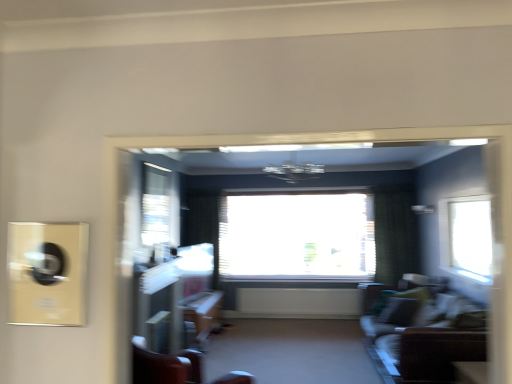
Question: Is transparent glass window at upper center, which appears as the 2th window when viewed from the back, behind velvet green sofa at lower right?

Choices:
 (A) yes
 (B) no

Answer: (A)

Question: Does transparent glass window at upper center, which appears as the 2th window when viewed from the back, have a smaller size compared to velvet green sofa at lower right?

Choices:
 (A) no
 (B) yes

Answer: (B)

Question: Is transparent glass window at upper center, the third window when ordered from right to left, positioned beyond the bounds of velvet green sofa at lower right?

Choices:
 (A) yes
 (B) no

Answer: (A)

Question: From the image's perspective, is transparent glass window at upper center, which appears as the 2th window when viewed from the back, on velvet green sofa at lower right?

Choices:
 (A) yes
 (B) no

Answer: (A)

Question: From a real-world perspective, is transparent glass window at upper center, the third window when ordered from right to left, below velvet green sofa at lower right?

Choices:
 (A) no
 (B) yes

Answer: (A)

Question: Considering the positions of matte brown table at lower right, the second table in the back-to-front sequence, and transparent glass window at center, arranged as the 2th window when viewed from the left, in the image, is matte brown table at lower right, the second table in the back-to-front sequence, wider or thinner than transparent glass window at center, arranged as the 2th window when viewed from the left,?

Choices:
 (A) wide
 (B) thin

Answer: (B)

Question: Considering their positions, is matte brown table at lower right, the second table in the back-to-front sequence, located in front of or behind transparent glass window at center, acting as the 3th window starting from the front?

Choices:
 (A) front
 (B) behind

Answer: (A)

Question: From a real-world perspective, is matte brown table at lower right, which ranks as the 1th table in right-to-left order, physically located above or below transparent glass window at center, acting as the 3th window starting from the front?

Choices:
 (A) below
 (B) above

Answer: (A)

Question: Would you say matte brown table at lower right, which ranks as the 1th table in right-to-left order, is inside or outside transparent glass window at center, the 1th window positioned from the back?

Choices:
 (A) inside
 (B) outside

Answer: (B)

Question: Is point (472, 216) positioned closer to the camera than point (244, 374)?

Choices:
 (A) farther
 (B) closer

Answer: (B)

Question: Would you say transparent glass window at right, marked as the first window in a front-to-back arrangement, is inside or outside wooden chair at center?

Choices:
 (A) inside
 (B) outside

Answer: (B)

Question: From a real-world perspective, is transparent glass window at right, positioned as the third window in left-to-right order, above or below wooden chair at center?

Choices:
 (A) below
 (B) above

Answer: (B)

Question: From the image's perspective, relative to wooden chair at center, is transparent glass window at right, positioned as the third window in left-to-right order, above or below?

Choices:
 (A) below
 (B) above

Answer: (B)

Question: From the image's perspective, is transparent glass window at right, arranged as the third window when viewed from the back, located above or below transparent glass window at upper center, acting as the first window starting from the left?

Choices:
 (A) above
 (B) below

Answer: (B)

Question: From a real-world perspective, relative to transparent glass window at upper center, the second window when ordered from front to back, is transparent glass window at right, positioned as the third window in left-to-right order, vertically above or below?

Choices:
 (A) below
 (B) above

Answer: (A)